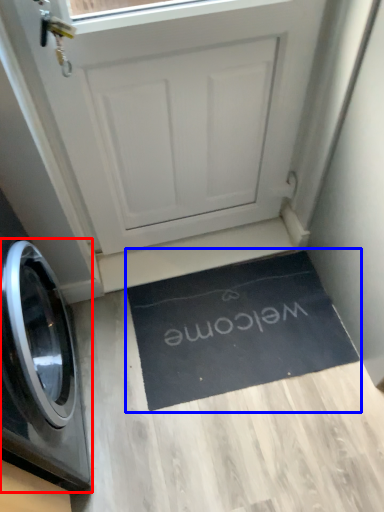
Question: Which object is closer to the camera taking this photo, washing machine (highlighted by a red box) or doormat (highlighted by a blue box)?

Choices:
 (A) washing machine
 (B) doormat

Answer: (A)